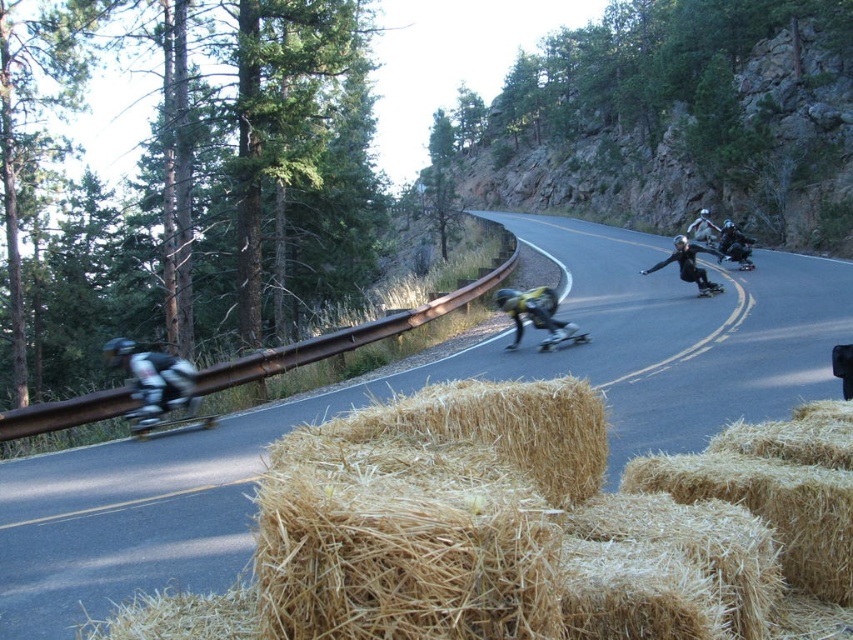
Question: Which point is farther from the camera taking this photo?

Choices:
 (A) (616, 390)
 (B) (566, 330)

Answer: (B)

Question: Is asphalt road at center smaller than black matte skateboard at center?

Choices:
 (A) no
 (B) yes

Answer: (A)

Question: Can you confirm if asphalt road at center is smaller than metallic silver skateboard at left?

Choices:
 (A) no
 (B) yes

Answer: (A)

Question: Which of the following is the closest to the observer?

Choices:
 (A) metallic silver skateboard at left
 (B) black matte skateboard at center
 (C) asphalt road at center

Answer: (C)

Question: Among these objects, which one is nearest to the camera?

Choices:
 (A) metallic silver skateboard at left
 (B) asphalt road at center
 (C) black matte skateboard at center

Answer: (B)

Question: Does metallic silver skateboard at left have a larger size compared to black matte skateboard at center?

Choices:
 (A) yes
 (B) no

Answer: (A)